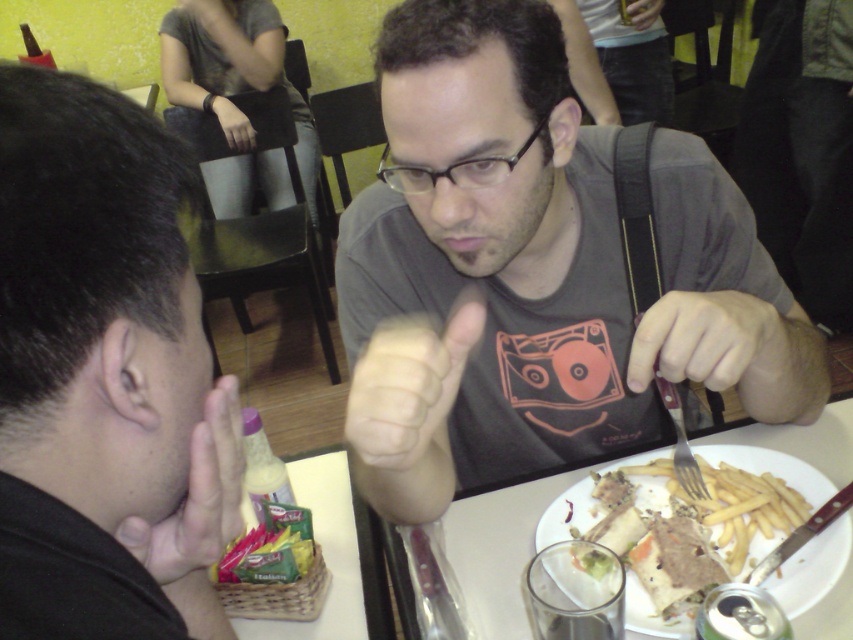
Based on the photo, you are a waiter holding a tray of drinks and need to place them on the table without spilling. The smooth skin hand at lower left is in your path. Can you safely navigate around it to reach the table?

The smooth skin hand at lower left is 15.24 inches away from the viewer, so yes, you can safely navigate around it to reach the table as the distance allows enough space to maneuver without spilling the drinks.

You are a photographer trying to capture a closeup of the black matte shirt at upper center and the smooth skin hand at lower left. Which object should you focus on first to ensure it appears sharp in the photo?

The black matte shirt at upper center is closer to the viewer than the smooth skin hand at lower left, so you should focus on the black matte shirt at upper center first to ensure it appears sharp.

You are a waiter at the restaurant. You need to deliver a drink to the customer whose hand is visible at the lower left. The glasses at the center are already occupied. Can you place the drink next to the transparent plastic glasses at center without it being too close to the smooth skin hand at lower left?

The smooth skin hand at lower left is thinner than transparent plastic glasses at center, so placing the drink next to the transparent plastic glasses at center would ensure it is not too close to the hand since the glasses are wider.